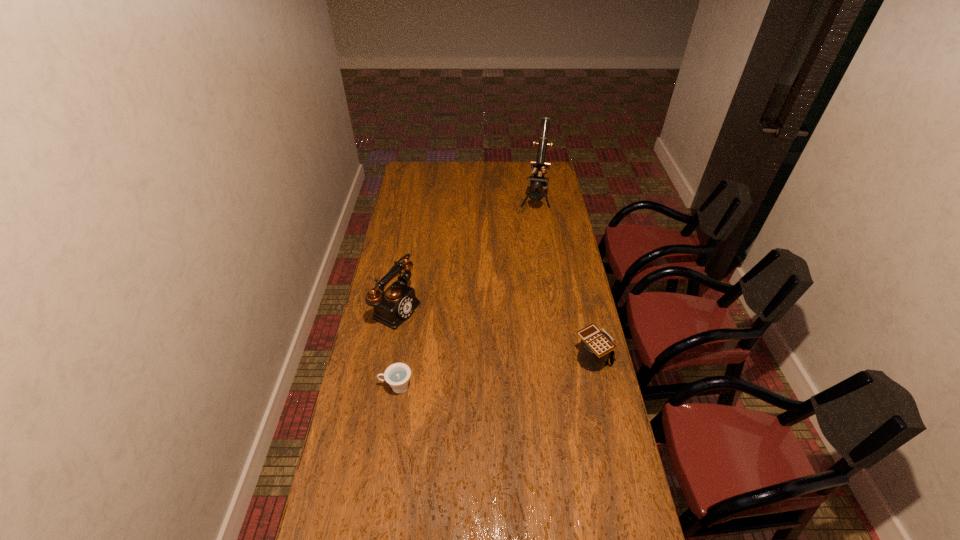
Where is `vacant spot on the desktop that is between the shortest object and the third tallest object and is positioned through the eyepiece of the tallest object`? vacant spot on the desktop that is between the shortest object and the third tallest object and is positioned through the eyepiece of the tallest object is located at coordinates (501, 372).

Locate an element on the screen. The height and width of the screenshot is (540, 960). vacant spot on the desktop that is between the teacup and the second shortest object and is positioned on the front of the telephone at the rotary dial is located at coordinates (525, 368).